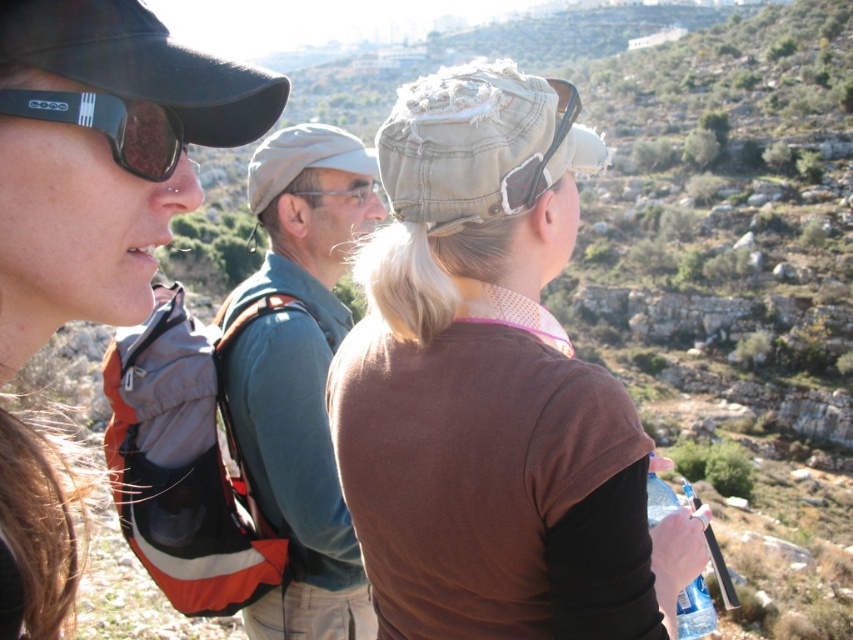
You are a photographer trying to capture a photo of the two people at the center of the image. You notice that the brown cotton shirt at center and the light gray fabric cap at center are overlapping. Which object should you adjust to ensure both are fully visible in the photo?

The brown cotton shirt at center has a lesser height compared to light gray fabric cap at center, so you should adjust the brown cotton shirt at center to ensure both are fully visible in the photo.

You are planning to take a photo of the brown cotton shirt at center and the clear plastic bottle at lower right. Which object should you zoom in on to ensure both fit in the frame without cropping?

You should zoom in on the clear plastic bottle at lower right because the brown cotton shirt at center is wider than the clear plastic bottle at lower right, so zooming in on the wider object would help both fit better in the frame.